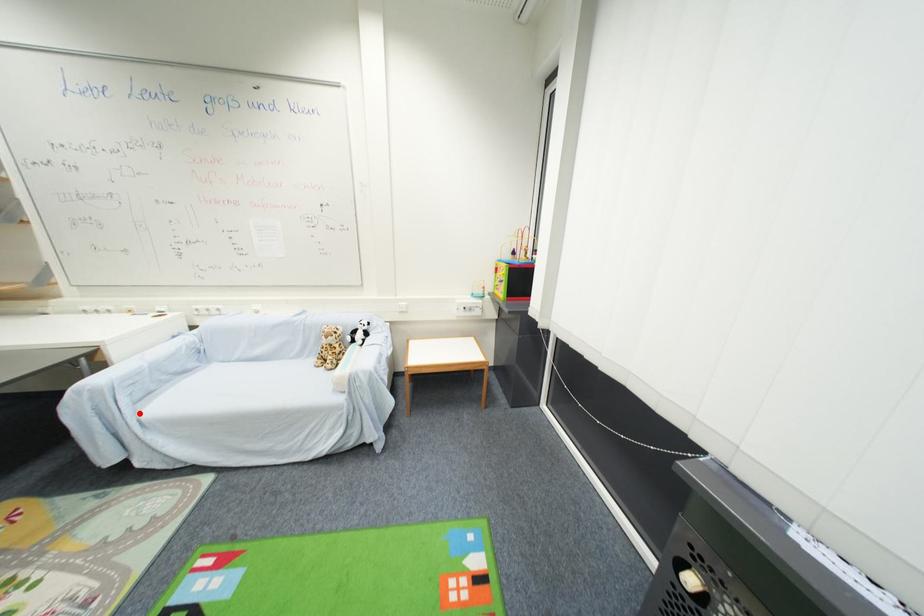
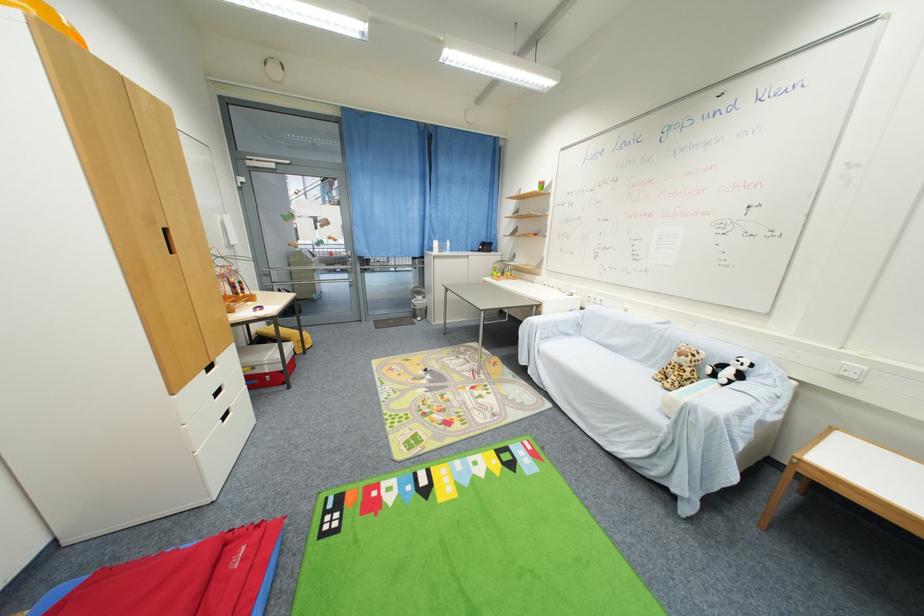
Question: I am providing you with two images of the same scene from different viewpoints. Image1 has a red point marked. In image2, the corresponding 3D location appears at what relative position? Reply with the corresponding letter.

Choices:
 (A) Closer
 (B) Farther

Answer: (B)